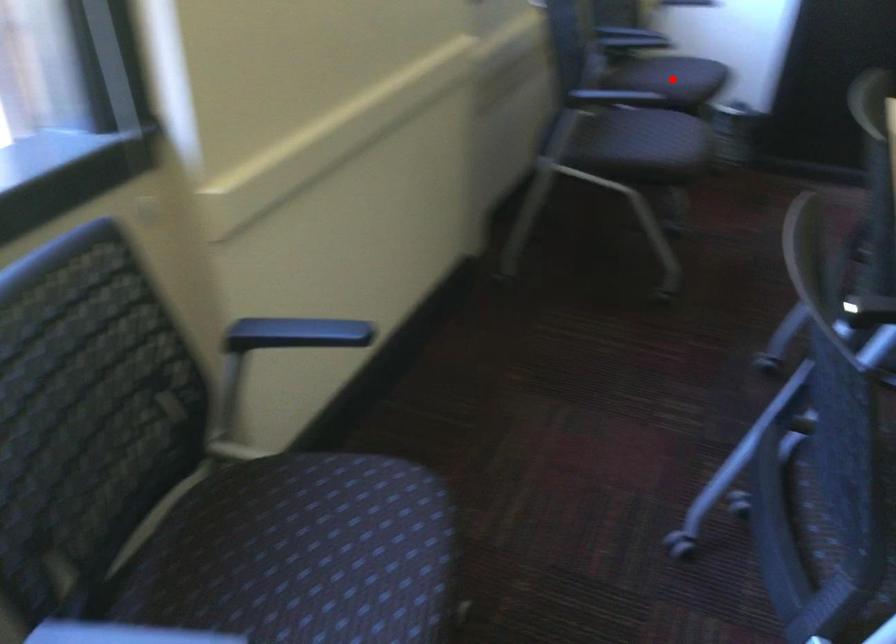
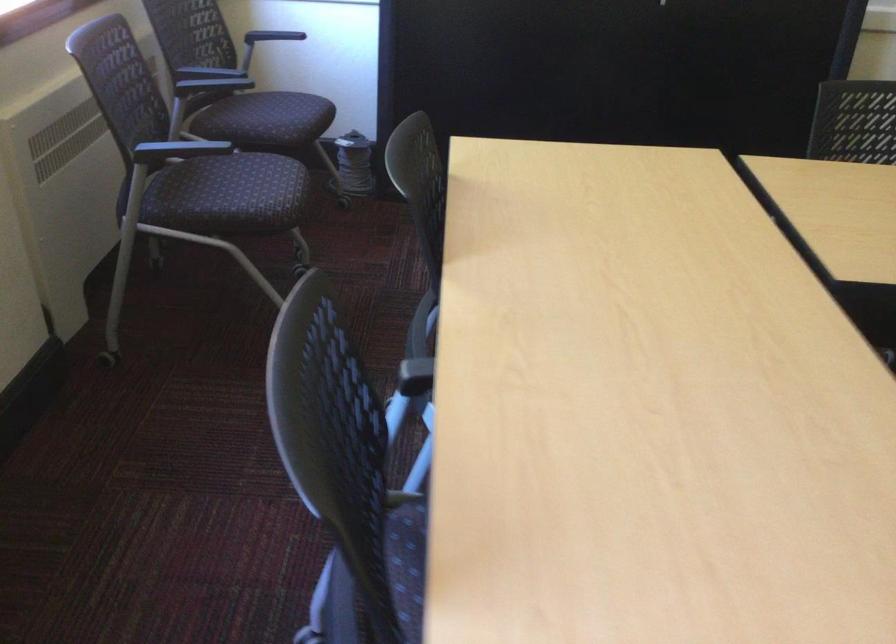
Where in the second image is the point corresponding to the highlighted location from the first image?

(271, 120)